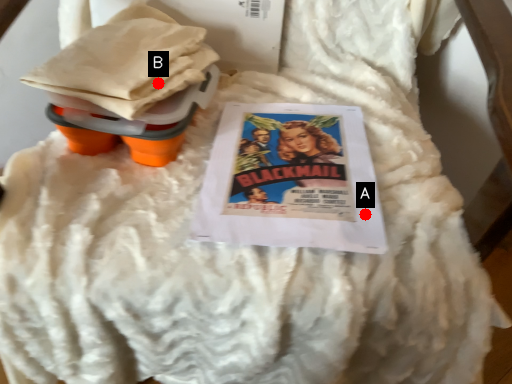
Question: Two points are circled on the image, labeled by A and B beside each circle. Which point is closer to the camera?

Choices:
 (A) A is closer
 (B) B is closer

Answer: (A)